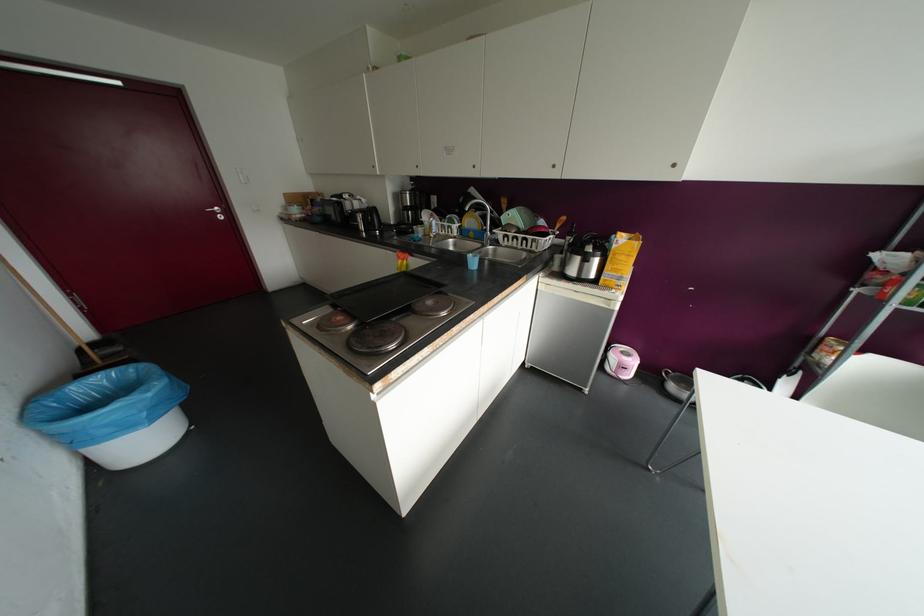
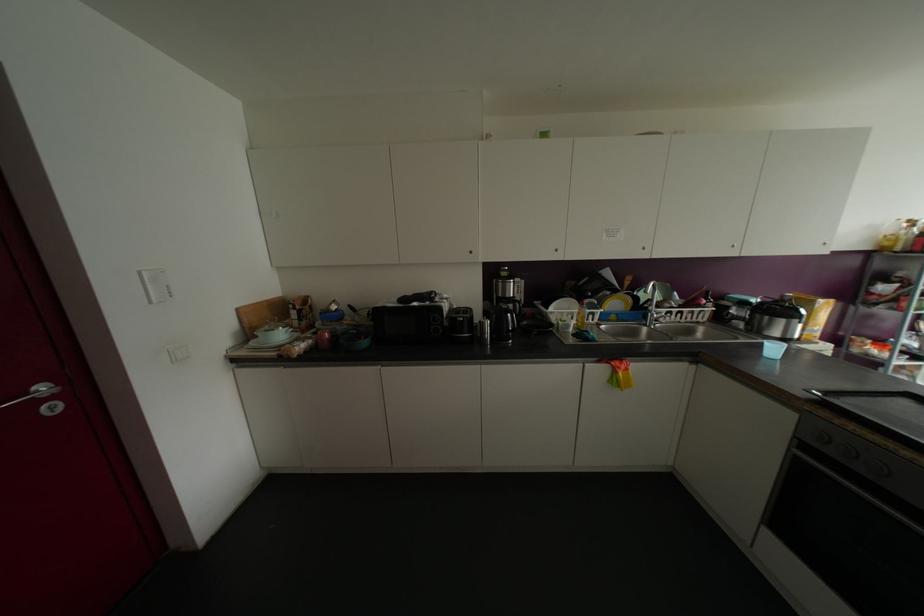
Locate, in the second image, the point that corresponds to point 469,221 in the first image.

(614, 302)